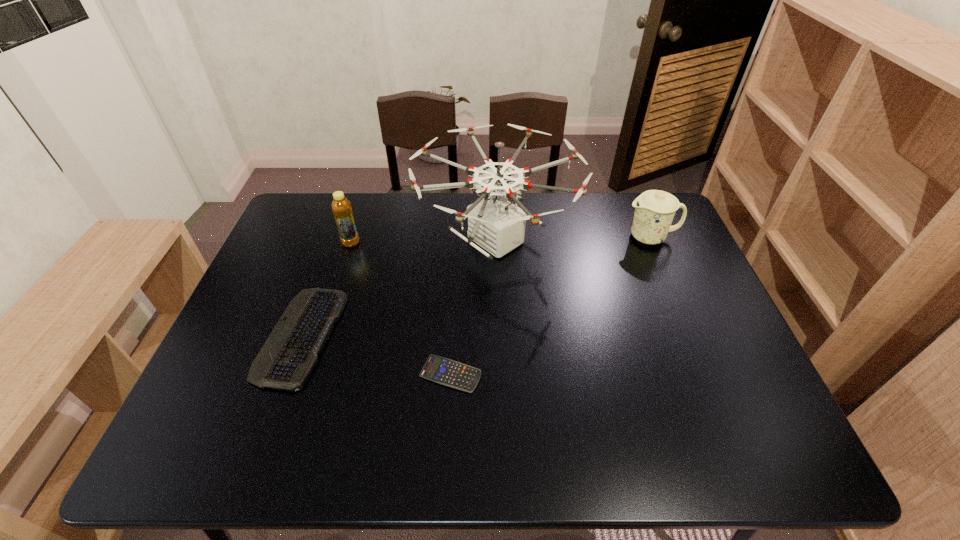
Where is `vacant position at the right edge of the desktop`? This screenshot has height=540, width=960. vacant position at the right edge of the desktop is located at coordinates (661, 277).

At what (x,y) coordinates should I click in order to perform the action: click on free space at the near left corner. Please return your answer as a coordinate pair (x, y). Image resolution: width=960 pixels, height=540 pixels. Looking at the image, I should click on (209, 448).

The height and width of the screenshot is (540, 960). What are the coordinates of `vacant region at the near right corner of the desktop` in the screenshot? It's located at (786, 465).

The image size is (960, 540). What are the coordinates of `free space that is in between the tallest object and the computer keyboard` in the screenshot? It's located at [x=398, y=289].

This screenshot has width=960, height=540. I want to click on vacant area between the rightmost object and the computer keyboard, so click(475, 287).

The height and width of the screenshot is (540, 960). In order to click on vacant area between the chinaware and the drone in this screenshot , I will do `click(573, 239)`.

The width and height of the screenshot is (960, 540). What are the coordinates of `free spot between the tallest object and the second shortest object` in the screenshot? It's located at (398, 289).

This screenshot has height=540, width=960. I want to click on vacant area that lies between the chinaware and the tallest object, so click(573, 239).

Locate an element on the screen. Image resolution: width=960 pixels, height=540 pixels. free spot between the shortest object and the tallest object is located at coordinates (473, 308).

Identify the location of empty space that is in between the chinaware and the drone. The image size is (960, 540). (573, 239).